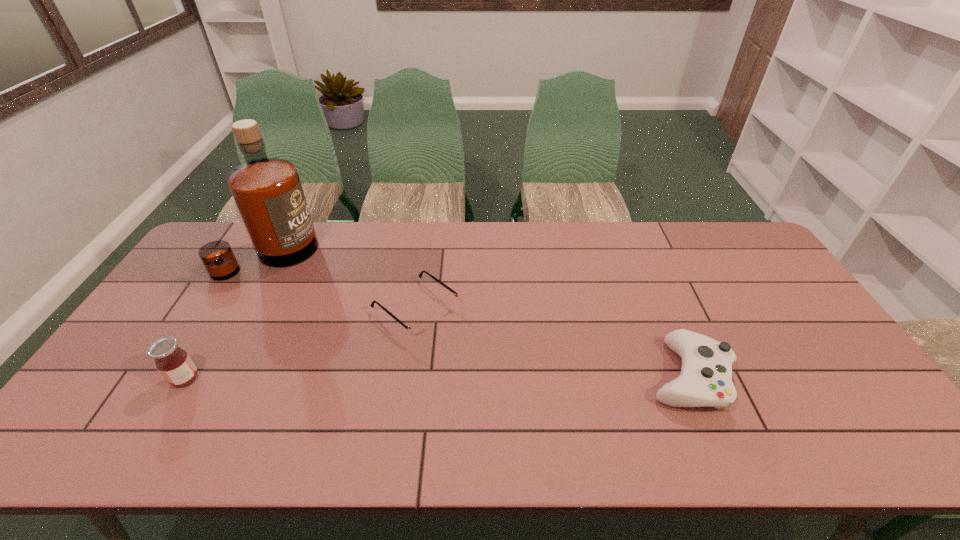
You are a GUI agent. You are given a task and a screenshot of the screen. Output one action in this format:
    pyautogui.click(x=<x>, y=<y>)
    Task: Click on the free space on the desktop that is between the second tallest object and the second shortest object and is positioned on the front label of the liquor
    The height and width of the screenshot is (540, 960).
    Given the screenshot: What is the action you would take?
    pyautogui.click(x=371, y=377)

The width and height of the screenshot is (960, 540). In order to click on vacant spot on the desktop that is between the third shortest object and the control and is positioned at the hinge ends of the shortest object in this screenshot , I will do `click(502, 377)`.